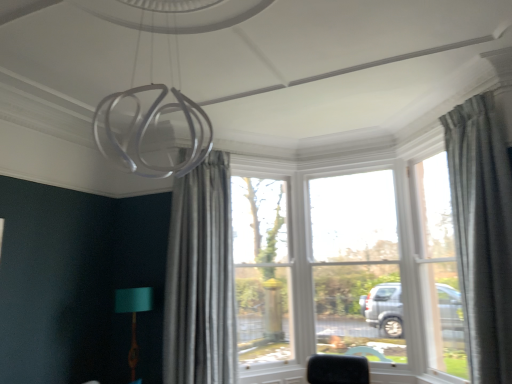
Question: Should I look upward or downward to see teal fabric lampshade at lower left?

Choices:
 (A) up
 (B) down

Answer: (B)

Question: Is textured gray curtain at right, marked as the 1th curtain in a front-to-back arrangement, a part of clear glass window at center, which is counted as the 1th window, starting from the left?

Choices:
 (A) yes
 (B) no

Answer: (B)

Question: Is clear glass window at center, which ranks as the second window in right-to-left order, not near textured gray curtain at right, marked as the 1th curtain in a right-to-left arrangement?

Choices:
 (A) yes
 (B) no

Answer: (A)

Question: Can you confirm if clear glass window at center, which ranks as the second window in right-to-left order, is shorter than textured gray curtain at right, marked as the 1th curtain in a right-to-left arrangement?

Choices:
 (A) no
 (B) yes

Answer: (A)

Question: From a real-world perspective, is clear glass window at center, which is counted as the 1th window, starting from the left, on textured gray curtain at right, marked as the 1th curtain in a front-to-back arrangement?

Choices:
 (A) no
 (B) yes

Answer: (A)

Question: Is clear glass window at center, which ranks as the second window in right-to-left order, positioned beyond the bounds of textured gray curtain at right, marked as the 1th curtain in a front-to-back arrangement?

Choices:
 (A) no
 (B) yes

Answer: (B)

Question: Does clear glass window at center, which is counted as the 1th window, starting from the left, have a greater width compared to textured gray curtain at right, marked as the 1th curtain in a front-to-back arrangement?

Choices:
 (A) yes
 (B) no

Answer: (B)

Question: From the image's perspective, is textured gray curtain at right, arranged as the 2th curtain when viewed from the left, beneath clear glass window at center, which is counted as the 1th window, starting from the left?

Choices:
 (A) no
 (B) yes

Answer: (A)

Question: Does textured gray curtain at right, arranged as the 2th curtain when viewed from the left, have a larger size compared to clear glass window at center, which ranks as the second window in right-to-left order?

Choices:
 (A) yes
 (B) no

Answer: (A)

Question: Is the depth of textured gray curtain at right, marked as the 1th curtain in a right-to-left arrangement, greater than that of clear glass window at center, which ranks as the second window in right-to-left order?

Choices:
 (A) no
 (B) yes

Answer: (A)

Question: Does textured gray curtain at right, the 2th curtain when ordered from back to front, have a lesser width compared to clear glass window at center, which ranks as the second window in right-to-left order?

Choices:
 (A) no
 (B) yes

Answer: (A)

Question: Can we say textured gray curtain at right, the 2th curtain when ordered from back to front, lies outside clear glass window at center, which is counted as the 1th window, starting from the left?

Choices:
 (A) no
 (B) yes

Answer: (B)

Question: Could you tell me if textured gray curtain at right, marked as the 1th curtain in a front-to-back arrangement, is turned towards clear glass window at center, which is counted as the 1th window, starting from the left?

Choices:
 (A) yes
 (B) no

Answer: (B)

Question: Is textured gray curtain at right, marked as the 1th curtain in a right-to-left arrangement, completely or partially outside of teal fabric lampshade at lower left?

Choices:
 (A) yes
 (B) no

Answer: (A)